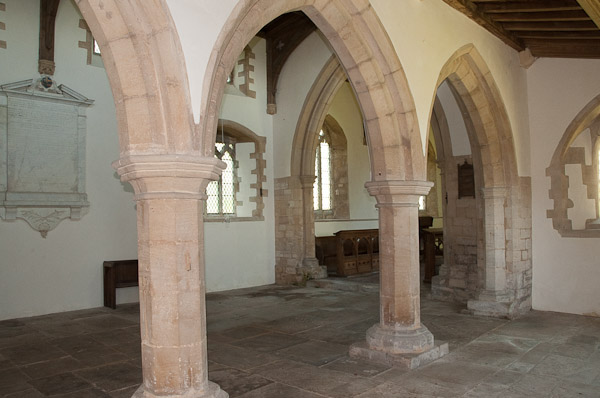
Locate an element on the screen. windows is located at coordinates (325, 164), (220, 193), (423, 201).